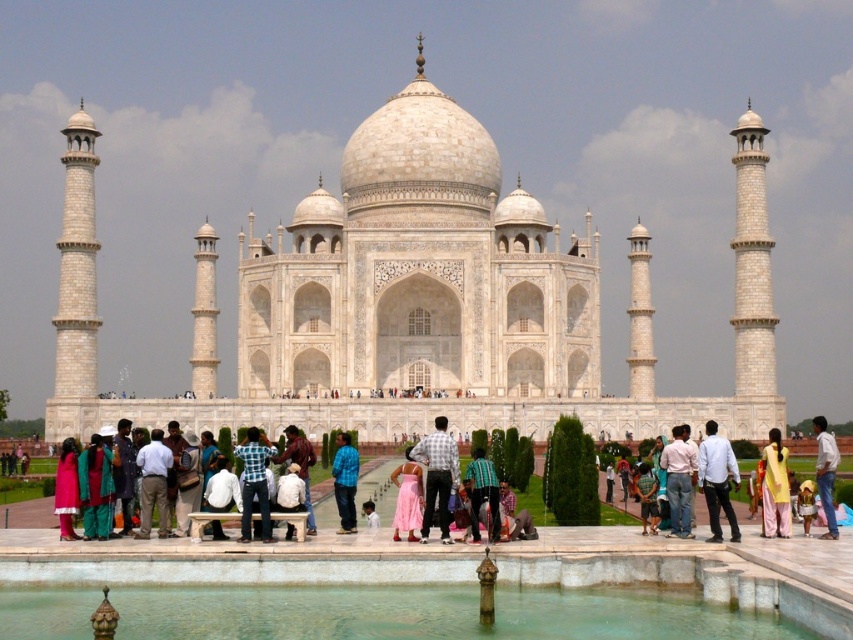
You are a photographer visiting the Taj Mahal and want to capture a photo of the blue denim jeans at center and the yellow fabric dress at lower right. Based on their positions, which object should you focus on first if you are moving from left to right across the scene?

The blue denim jeans at center should be focused on first because it is positioned to the left of the yellow fabric dress at lower right, so as you move from left to right, you encounter it first.

You are standing at the entrance of the Taj Mahal and notice a yellow fabric dress at lower right. Where exactly is the yellow fabric dress positioned relative to the central dome?

The yellow fabric dress at lower right is located at point (775,486), which is to the lower right side of the central dome.

You are a photographer planning to capture a wide shot of the Taj Mahal. You notice a yellow fabric dress at lower right and blue denim jeans at center in the foreground. To ensure both items are fully visible in your frame, which item requires more horizontal space in the composition?

The yellow fabric dress at lower right might be wider than blue denim jeans at center, so it requires more horizontal space in the composition to ensure it is fully visible.